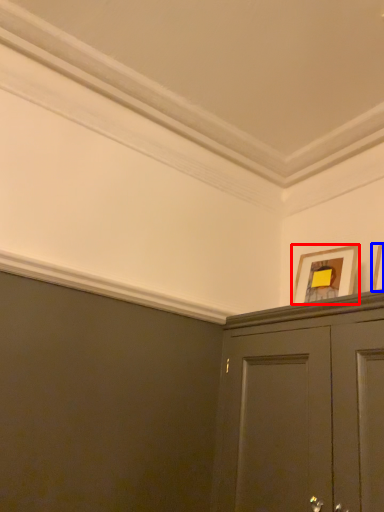
Question: Which point is further to the camera, picture frame (highlighted by a red box) or picture frame (highlighted by a blue box)?

Choices:
 (A) picture frame
 (B) picture frame

Answer: (A)